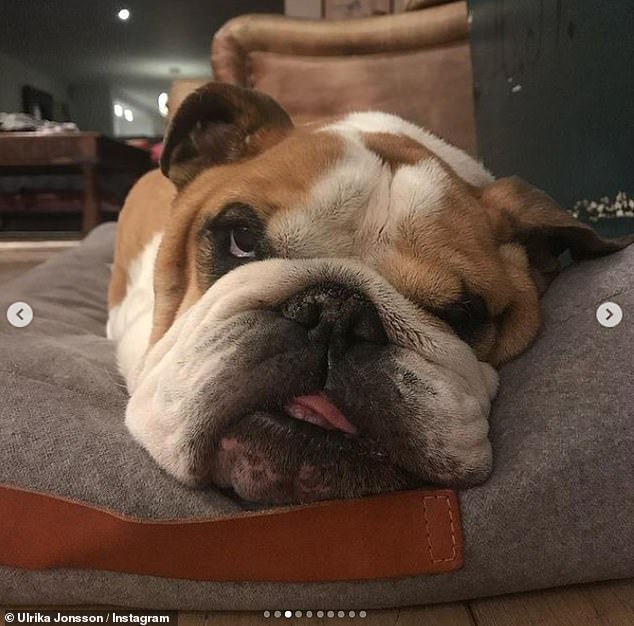
The width and height of the screenshot is (634, 626). What are the coordinates of `dog bed` in the screenshot? It's located at (56, 342).